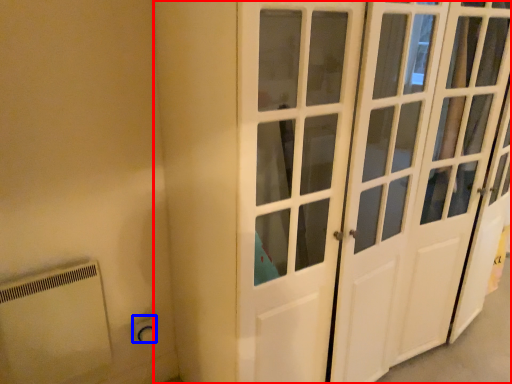
Question: Which point is closer to the camera, door (highlighted by a red box) or electric outlet (highlighted by a blue box)?

Choices:
 (A) door
 (B) electric outlet

Answer: (A)